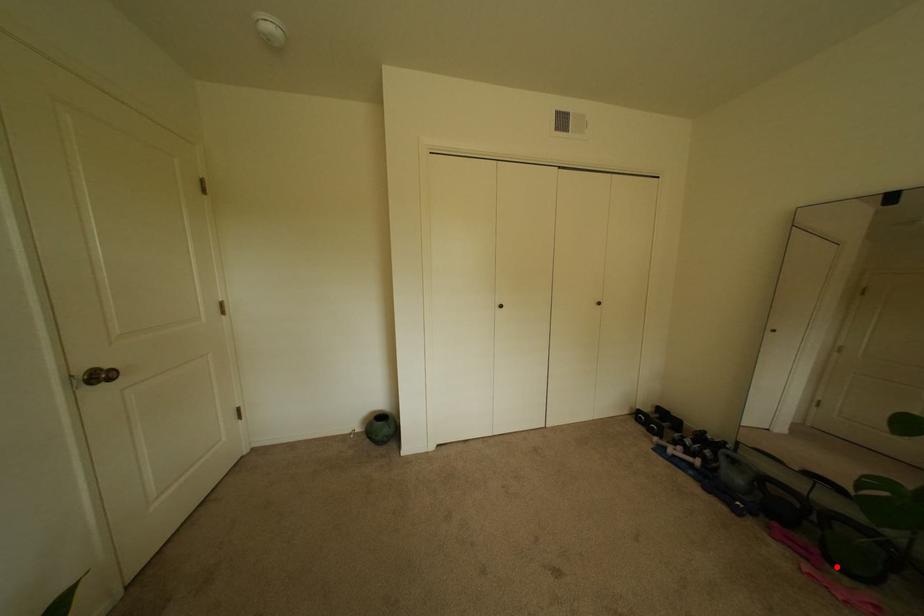
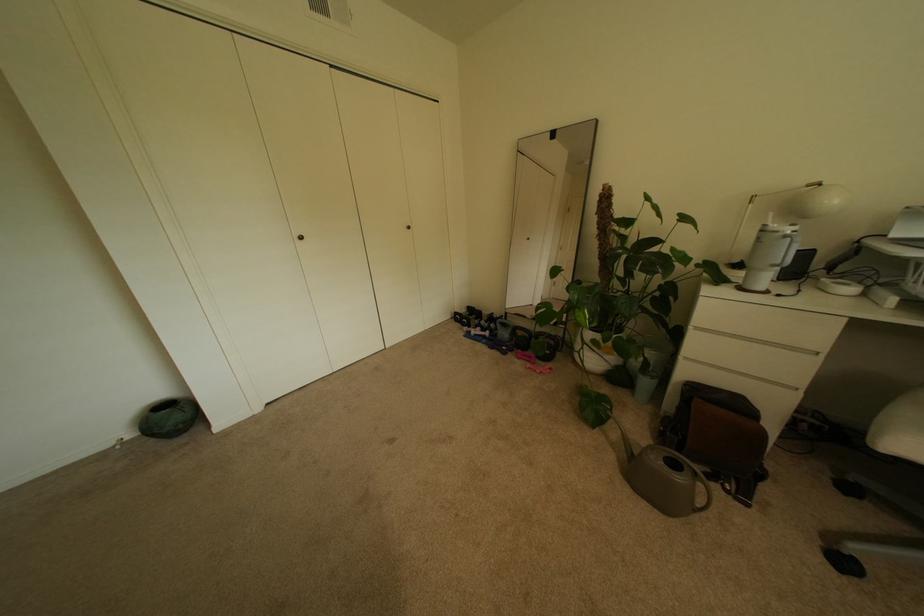
Question: I am providing you with two images of the same scene from different viewpoints. Given a red point in image1, look at the same physical point in image2. Is it:

Choices:
 (A) Closer to the viewpoint
 (B) Farther from the viewpoint

Answer: (A)